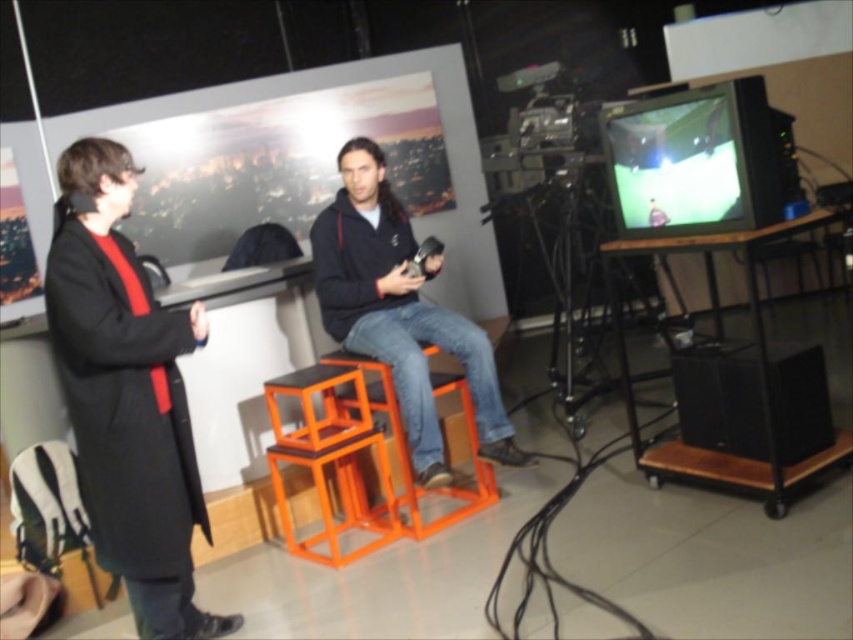
You are standing at the point labeled point (112,280) and want to move to the point labeled point (410,488). Which direction should you move to reach your destination?

To move from point (112,280) to point (410,488), you should move backward since point (112,280) is in front of point (410,488).

You are a photographer positioned in the studio and want to take a photo that includes both the standing person and the seated person on the orange stool. Which of the two points, point (143, 556) or point (393, 499), should you focus on first to ensure both subjects are in clear focus?

Point (143, 556) is closer to the viewer than point (393, 499). To ensure both subjects are in clear focus, you should focus on the closer point first, which is point (143, 556).

You are designing a storage space and need to place the matte black coat at left and the orange plastic stool at center into a narrow closet. Which item can fit through the narrow entrance first?

The matte black coat at left can fit through the narrow entrance first because it is thinner than the orange plastic stool at center.